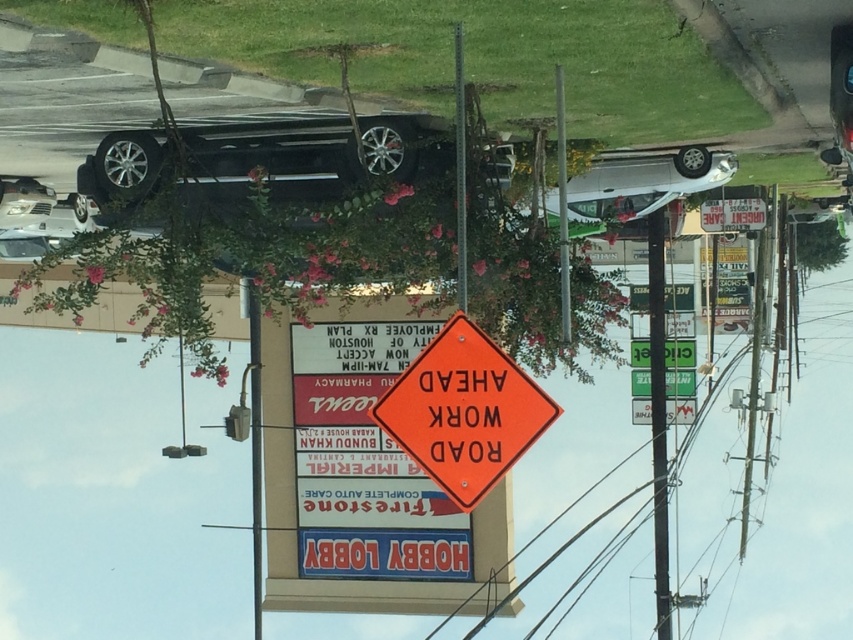
Question: Is orange diamond-shaped road work sign at center to the left of orange plastic diamond at center from the viewer's perspective?

Choices:
 (A) no
 (B) yes

Answer: (B)

Question: Does metallic pole at center-right appear under metallic pole at upper center?

Choices:
 (A) yes
 (B) no

Answer: (A)

Question: Can you confirm if shiny silver car at upper center is wider than orange plastic road work sign at center?

Choices:
 (A) yes
 (B) no

Answer: (A)

Question: Which point is farther from the camera taking this photo?

Choices:
 (A) (718, 170)
 (B) (660, 397)

Answer: (B)

Question: Which point is closer to the camera?

Choices:
 (A) white matte car at upper right
 (B) orange reflective road work sign at center
 (C) metallic pole at center-right

Answer: (B)

Question: Considering the real-world distances, which object is closest to the metallic pole at upper center?

Choices:
 (A) orange plastic diamond at center
 (B) orange diamond-shaped road work sign at center
 (C) metallic pole at center-right
 (D) orange reflective road work sign at center

Answer: (D)